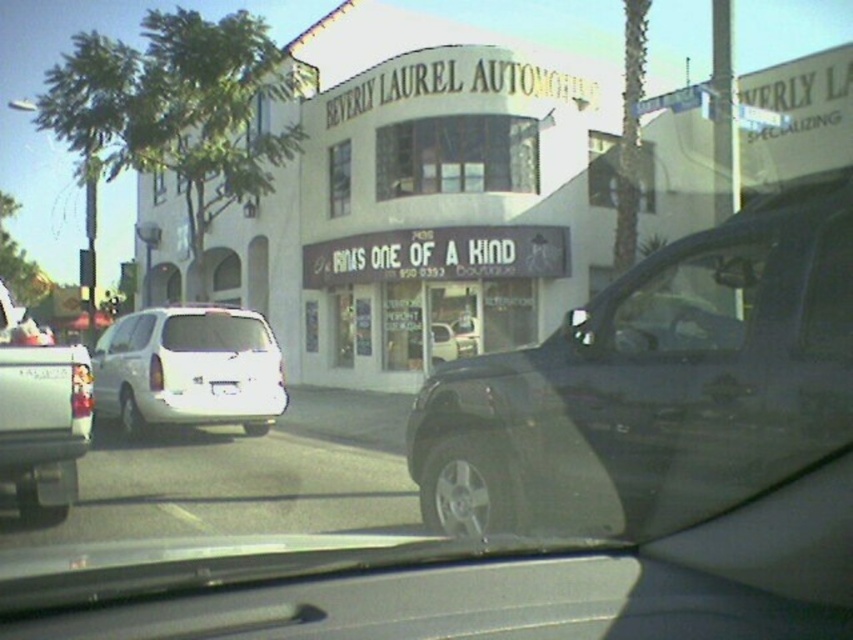
Question: Does clear glass windshield at center have a larger size compared to transparent glass window at center?

Choices:
 (A) no
 (B) yes

Answer: (A)

Question: Which of the following is the closest to the observer?

Choices:
 (A) white matte minivan at left
 (B) clear glass windshield at center
 (C) white matte truck at left
 (D) clear glass window at center

Answer: (C)

Question: Among these objects, which one is nearest to the camera?

Choices:
 (A) white matte minivan at left
 (B) transparent glass window at center
 (C) white matte truck at left
 (D) shiny black car at center

Answer: (D)

Question: Can you confirm if white matte minivan at left is bigger than clear glass windshield at center?

Choices:
 (A) no
 (B) yes

Answer: (B)

Question: Does clear glass windshield at center appear on the left side of white plastic license plate at center?

Choices:
 (A) yes
 (B) no

Answer: (A)

Question: Which object is closer to the camera taking this photo?

Choices:
 (A) white plastic license plate at center
 (B) white matte minivan at left

Answer: (B)